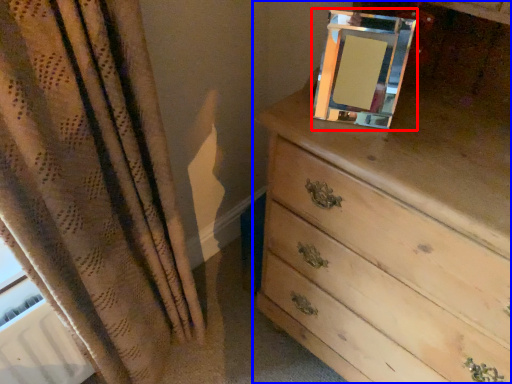
Question: Which point is closer to the camera, picture frame (highlighted by a red box) or chest of drawers (highlighted by a blue box)?

Choices:
 (A) picture frame
 (B) chest of drawers

Answer: (B)